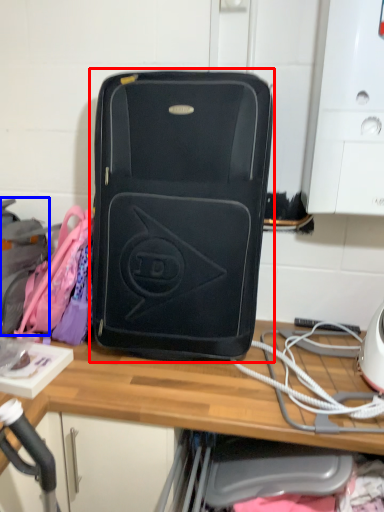
Question: Which object appears farthest to the camera in this image, luggage and bags (highlighted by a red box) or luggage (highlighted by a blue box)?

Choices:
 (A) luggage and bags
 (B) luggage

Answer: (B)